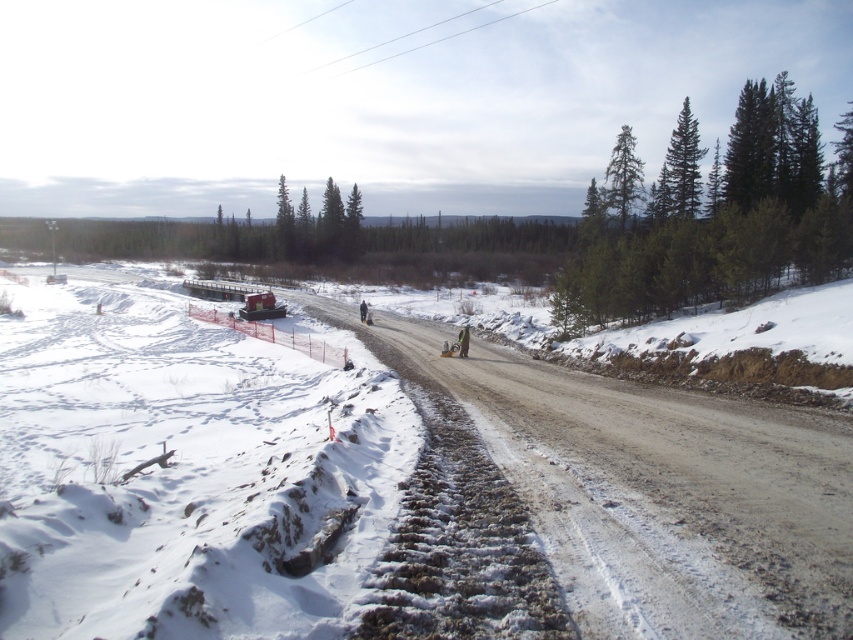
You are standing at the edge of the snowy landscape and want to walk towards the dark brown leather jacket at center. Is the dusty gravel road at center in your way?

The dusty gravel road at center is closer to the viewer than the dark brown leather jacket at center, so yes, the road is in your way as you walk towards the jacket.

You are a hiker trying to navigate the snowy landscape. You see the dusty gravel road at center and the dark brown leather jacket at center. Which object is longer in length?

The dark brown leather jacket at center is longer than the dusty gravel road at center.

You are navigating a vehicle along the dusty gravel road at center. The coordinates of the road are given as point 0.766, 0.767. If you continue straight, will you eventually reach the red vehicle parked in the fenced area on the left side of the road?

The dusty gravel road at center is located at point (653, 490). Since the red vehicle is parked in the fenced area on the left side of the road, continuing straight on the road would not lead directly to the vehicle as it is positioned off the main path.